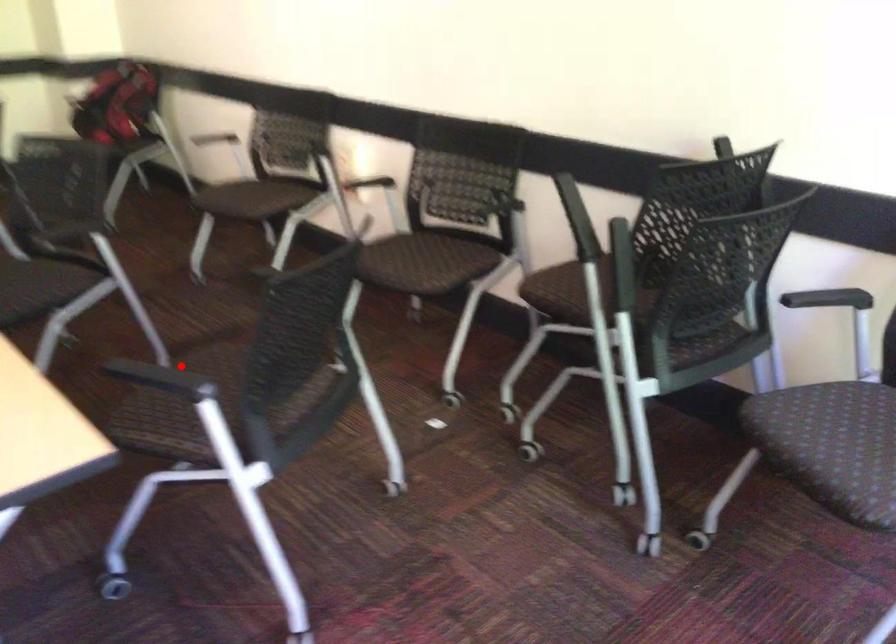
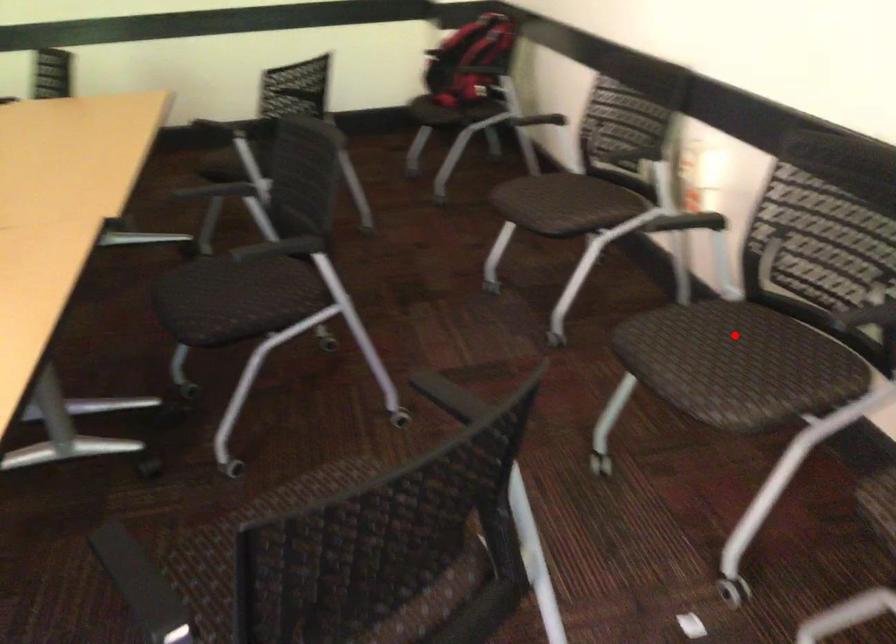
I am providing you with two images of the same scene from different viewpoints. A red point is marked on the first image and another point is marked on the second image. Do the highlighted points in image1 and image2 indicate the same real-world spot?

No